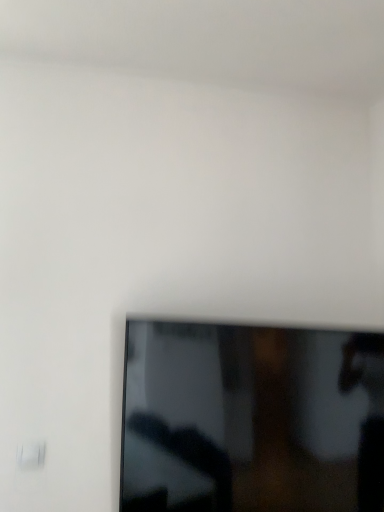
Image resolution: width=384 pixels, height=512 pixels. What are the coordinates of `matte black tv at lower center` in the screenshot? It's located at (251, 419).

The height and width of the screenshot is (512, 384). Describe the element at coordinates (251, 419) in the screenshot. I see `matte black tv at lower center` at that location.

This screenshot has height=512, width=384. I want to click on matte black tv at lower center, so click(251, 419).